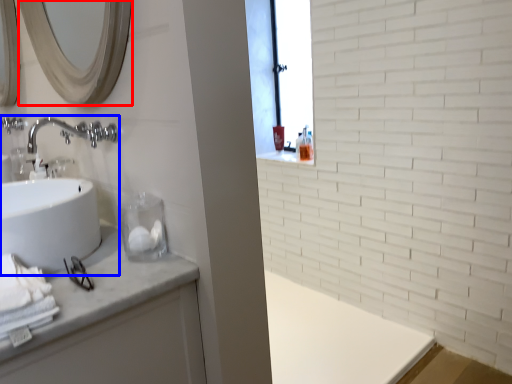
Question: Which object is further to the camera taking this photo, mirror (highlighted by a red box) or sink (highlighted by a blue box)?

Choices:
 (A) mirror
 (B) sink

Answer: (B)